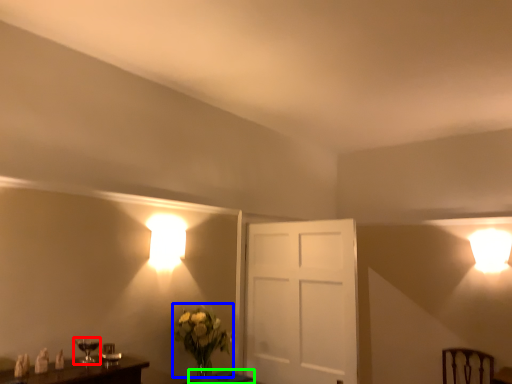
Question: Estimate the real-world distances between objects in this image. Which object is closer to table lamp (highlighted by a red box), floral arrangement (highlighted by a blue box) or table (highlighted by a green box)?

Choices:
 (A) floral arrangement
 (B) table

Answer: (A)